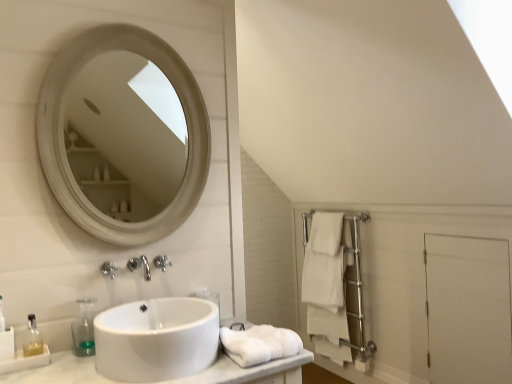
How much space does white cotton towel at right, positioned as the 2th bath towel in front-to-back order, occupy horizontally?

white cotton towel at right, positioned as the 2th bath towel in front-to-back order, is 14.95 centimeters wide.

Locate an element on the screen. This screenshot has width=512, height=384. translucent plastic soap dispenser at lower left, the second soap dispenser when ordered from right to left is located at coordinates (32, 338).

You are a GUI agent. You are given a task and a screenshot of the screen. Output one action in this format:
    pyautogui.click(x=<x>, y=<y>)
    Task: Click on the translucent glass soap dispenser at lower left
    The image size is (512, 384).
    Given the screenshot: What is the action you would take?
    pyautogui.click(x=2, y=318)

You are a GUI agent. You are given a task and a screenshot of the screen. Output one action in this format:
    pyautogui.click(x=<x>, y=<y>)
    Task: Click on the white cotton towel at right, positioned as the 2th bath towel in front-to-back order
    The width and height of the screenshot is (512, 384).
    Given the screenshot: What is the action you would take?
    click(x=326, y=286)

Consider the image. Which object is further away from the camera taking this photo, white cotton towel at right, the 2th bath towel positioned from the top, or silver metallic faucet at lower center, which appears as the 2th faucet when viewed from the left?

white cotton towel at right, the 2th bath towel positioned from the top, is further away from the camera.

How different are the orientations of white cotton towel at right, the first bath towel positioned from the back, and silver metallic faucet at lower center, the first faucet in the right-to-left sequence, in degrees?

The angular difference between white cotton towel at right, the first bath towel positioned from the back, and silver metallic faucet at lower center, the first faucet in the right-to-left sequence, is 88.3 degrees.

Looking at this image, can you confirm if white cotton towel at right, which is the first bath towel in bottom-to-top order, is bigger than silver metallic faucet at lower center, arranged as the first faucet when viewed from the back?

Indeed, white cotton towel at right, which is the first bath towel in bottom-to-top order, has a larger size compared to silver metallic faucet at lower center, arranged as the first faucet when viewed from the back.

Can we say white cotton towel at right, the first bath towel positioned from the back, lies outside silver metallic faucet at lower center, acting as the second faucet starting from the front?

Yes, white cotton towel at right, the first bath towel positioned from the back, is outside of silver metallic faucet at lower center, acting as the second faucet starting from the front.

In the scene shown: From the image's perspective, which one is positioned lower, white matte screen door at right or white matte bath towel at lower center, marked as the first bath towel in a left-to-right arrangement?

white matte screen door at right, from the image's perspective.

From a real-world perspective, who is located lower, white matte screen door at right or white matte bath towel at lower center, the first bath towel from the top?

In real-world perspective, white matte screen door at right is lower.

Considering the positions of objects white matte screen door at right and white matte bath towel at lower center, the first bath towel from the top, in the image provided, who is in front, white matte screen door at right or white matte bath towel at lower center, the first bath towel from the top,?

white matte bath towel at lower center, the first bath towel from the top, is more forward.

Who is taller, white matte screen door at right or white matte bath towel at lower center, the 2th bath towel in the right-to-left sequence?

white matte screen door at right is taller.

Could you tell me if transparent plastic soap dispenser at lower left, positioned as the first soap dispenser in right-to-left order, is facing translucent plastic soap dispenser at lower left, the second soap dispenser when ordered from right to left?

No, transparent plastic soap dispenser at lower left, positioned as the first soap dispenser in right-to-left order, is not turned towards translucent plastic soap dispenser at lower left, the second soap dispenser when ordered from right to left.

Based on their sizes in the image, would you say transparent plastic soap dispenser at lower left, the second soap dispenser when ordered from left to right, is bigger or smaller than translucent plastic soap dispenser at lower left, which appears as the 1th soap dispenser when viewed from the left?

In the image, transparent plastic soap dispenser at lower left, the second soap dispenser when ordered from left to right, appears to be larger than translucent plastic soap dispenser at lower left, which appears as the 1th soap dispenser when viewed from the left.

From the image's perspective, between transparent plastic soap dispenser at lower left, the second soap dispenser when ordered from left to right, and translucent plastic soap dispenser at lower left, which appears as the 1th soap dispenser when viewed from the left, which one is located above?

transparent plastic soap dispenser at lower left, the second soap dispenser when ordered from left to right, is shown above in the image.

The image size is (512, 384). What are the coordinates of `soap dispenser located on the right of translucent plastic soap dispenser at lower left, the second soap dispenser when ordered from right to left` in the screenshot? It's located at (84, 328).

Which is behind, white cotton towel at right, which is the first bath towel in bottom-to-top order, or translucent glass soap dispenser at lower left?

white cotton towel at right, which is the first bath towel in bottom-to-top order, is further from the camera.

Does white cotton towel at right, positioned as the 2th bath towel in left-to-right order, have a lesser height compared to translucent glass soap dispenser at lower left?

In fact, white cotton towel at right, positioned as the 2th bath towel in left-to-right order, may be taller than translucent glass soap dispenser at lower left.

Is white cotton towel at right, the 2th bath towel positioned from the top, not within translucent glass soap dispenser at lower left?

Yes.

Is transparent plastic soap dispenser at lower left, the second soap dispenser when ordered from left to right, not close to satin nickel faucet at center, which is the 1th faucet in front-to-back order?

Actually, transparent plastic soap dispenser at lower left, the second soap dispenser when ordered from left to right, and satin nickel faucet at center, which is the 1th faucet in front-to-back order, are a little close together.

Who is shorter, transparent plastic soap dispenser at lower left, positioned as the first soap dispenser in right-to-left order, or satin nickel faucet at center, acting as the 1th faucet starting from the left?

Standing shorter between the two is satin nickel faucet at center, acting as the 1th faucet starting from the left.

What's the angular difference between transparent plastic soap dispenser at lower left, positioned as the first soap dispenser in right-to-left order, and satin nickel faucet at center, acting as the 1th faucet starting from the left,'s facing directions?

The angle between the facing direction of transparent plastic soap dispenser at lower left, positioned as the first soap dispenser in right-to-left order, and the facing direction of satin nickel faucet at center, acting as the 1th faucet starting from the left, is 0.925 degrees.

From a real-world perspective, between transparent plastic soap dispenser at lower left, positioned as the first soap dispenser in right-to-left order, and satin nickel faucet at center, which ranks as the 2th faucet in right-to-left order, who is vertically higher?

From a 3D spatial view, satin nickel faucet at center, which ranks as the 2th faucet in right-to-left order, is above.

Between white cotton towel at right, the first bath towel from the right, and transparent plastic soap dispenser at lower left, positioned as the first soap dispenser in right-to-left order, which one has more height?

With more height is white cotton towel at right, the first bath towel from the right.

Is transparent plastic soap dispenser at lower left, positioned as the first soap dispenser in right-to-left order, a part of white cotton towel at right, the 2th bath towel positioned from the top?

That's incorrect, transparent plastic soap dispenser at lower left, positioned as the first soap dispenser in right-to-left order, is not inside white cotton towel at right, the 2th bath towel positioned from the top.

Is white cotton towel at right, positioned as the 2th bath towel in left-to-right order, at the left side of transparent plastic soap dispenser at lower left, the second soap dispenser when ordered from left to right?

In fact, white cotton towel at right, positioned as the 2th bath towel in left-to-right order, is to the right of transparent plastic soap dispenser at lower left, the second soap dispenser when ordered from left to right.

Does translucent plastic soap dispenser at lower left, which appears as the 1th soap dispenser when viewed from the left, have a greater height compared to white matte screen door at right?

Incorrect, the height of translucent plastic soap dispenser at lower left, which appears as the 1th soap dispenser when viewed from the left, is not larger of that of white matte screen door at right.

From the image's perspective, is translucent plastic soap dispenser at lower left, the second soap dispenser when ordered from right to left, positioned above or below white matte screen door at right?

translucent plastic soap dispenser at lower left, the second soap dispenser when ordered from right to left, is situated higher than white matte screen door at right in the image.

Considering their positions, is translucent plastic soap dispenser at lower left, the second soap dispenser when ordered from right to left, located in front of or behind white matte screen door at right?

Visually, translucent plastic soap dispenser at lower left, the second soap dispenser when ordered from right to left, is located in front of white matte screen door at right.

At what (x,y) coordinates should I click in order to perform the action: click on the 1st faucet directly above the white cotton towel at right, the first bath towel from the right (from a real-world perspective). Please return your answer as a coordinate pair (x, y). This screenshot has height=384, width=512. Looking at the image, I should click on click(161, 262).

You are a GUI agent. You are given a task and a screenshot of the screen. Output one action in this format:
    pyautogui.click(x=<x>, y=<y>)
    Task: Click on the screen door that is behind the white matte bath towel at lower center, the 2th bath towel in the right-to-left sequence
    Image resolution: width=512 pixels, height=384 pixels.
    Given the screenshot: What is the action you would take?
    pyautogui.click(x=468, y=309)

Based on their spatial positions, is satin nickel faucet at center, which ranks as the 2th faucet in right-to-left order, or white matte screen door at right further from white glossy sink at center?

white matte screen door at right is further to white glossy sink at center.

From the image, which object appears to be nearer to transparent plastic soap dispenser at lower left, the second soap dispenser when ordered from left to right, translucent glass soap dispenser at lower left or white cotton towel at right, the first bath towel from the right?

translucent glass soap dispenser at lower left lies closer to transparent plastic soap dispenser at lower left, the second soap dispenser when ordered from left to right, than the other object.

From the image, which object appears to be nearer to white matte bath towel at lower center, the 2th bath towel in the right-to-left sequence, transparent plastic soap dispenser at lower left, the second soap dispenser when ordered from left to right, or satin nickel faucet at center, placed as the second faucet when sorted from back to front?

transparent plastic soap dispenser at lower left, the second soap dispenser when ordered from left to right, is closer to white matte bath towel at lower center, the 2th bath towel in the right-to-left sequence.

From the image, which object appears to be farther from translucent glass soap dispenser at lower left, translucent plastic soap dispenser at lower left, the second soap dispenser when ordered from right to left, or silver metallic faucet at lower center, which appears as the 2th faucet when viewed from the left?

silver metallic faucet at lower center, which appears as the 2th faucet when viewed from the left.

When comparing their distances from translucent glass soap dispenser at lower left, does satin nickel faucet at center, placed as the second faucet when sorted from back to front, or white matte screen door at right seem further?

Based on the image, white matte screen door at right appears to be further to translucent glass soap dispenser at lower left.

Based on the photo, looking at the image, which one is located closer to translucent plastic soap dispenser at lower left, which appears as the 1th soap dispenser when viewed from the left, white matte screen door at right or white matte bath towel at lower center, marked as the first bath towel in a left-to-right arrangement?

white matte bath towel at lower center, marked as the first bath towel in a left-to-right arrangement, is positioned closer to the anchor translucent plastic soap dispenser at lower left, which appears as the 1th soap dispenser when viewed from the left.

Which object lies nearer to the anchor point white matte bath towel at lower center, marked as the first bath towel in a left-to-right arrangement, translucent plastic soap dispenser at lower left, the second soap dispenser when ordered from right to left, or white glossy sink at center?

The object closer to white matte bath towel at lower center, marked as the first bath towel in a left-to-right arrangement, is white glossy sink at center.

Considering their positions, is translucent plastic soap dispenser at lower left, which appears as the 1th soap dispenser when viewed from the left, positioned further to white cotton towel at right, positioned as the 2th bath towel in front-to-back order, than transparent plastic soap dispenser at lower left, the second soap dispenser when ordered from left to right?

The object further to white cotton towel at right, positioned as the 2th bath towel in front-to-back order, is translucent plastic soap dispenser at lower left, which appears as the 1th soap dispenser when viewed from the left.

The height and width of the screenshot is (384, 512). Identify the location of faucet located between translucent plastic soap dispenser at lower left, which appears as the 1th soap dispenser when viewed from the left, and silver metallic faucet at lower center, arranged as the first faucet when viewed from the back, in the left-right direction. (109, 269).

Where is `faucet between translucent glass soap dispenser at lower left and silver metallic faucet at lower center, which appears as the 2th faucet when viewed from the left, in the horizontal direction`? The height and width of the screenshot is (384, 512). faucet between translucent glass soap dispenser at lower left and silver metallic faucet at lower center, which appears as the 2th faucet when viewed from the left, in the horizontal direction is located at coordinates (109, 269).

The height and width of the screenshot is (384, 512). What are the coordinates of `soap dispenser between translucent glass soap dispenser at lower left and transparent plastic soap dispenser at lower left, the second soap dispenser when ordered from left to right, from left to right` in the screenshot? It's located at (32, 338).

Identify the location of soap dispenser between translucent plastic soap dispenser at lower left, the second soap dispenser when ordered from right to left, and white matte screen door at right. This screenshot has height=384, width=512. pyautogui.click(x=84, y=328).